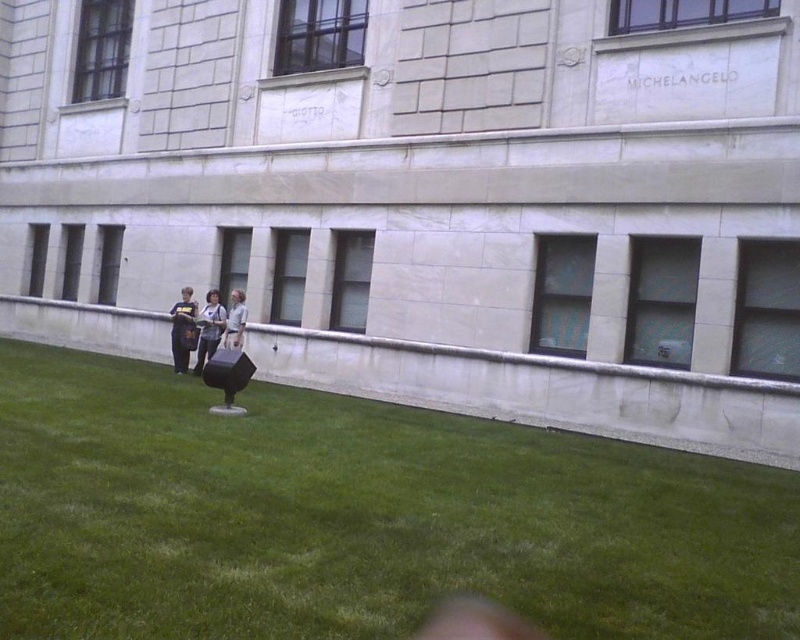
Question: Which of the following is the farthest from the observer?

Choices:
 (A) (194, 340)
 (B) (250, 630)

Answer: (A)

Question: Is green grass at lower center positioned before dark blue shirt at center?

Choices:
 (A) no
 (B) yes

Answer: (B)

Question: Is green grass at lower center to the right of light gray shirt at center from the viewer's perspective?

Choices:
 (A) no
 (B) yes

Answer: (B)

Question: Is dark blue shirt at center positioned behind light gray shirt at center?

Choices:
 (A) yes
 (B) no

Answer: (A)

Question: Which point is closer to the camera taking this photo?

Choices:
 (A) (236, 296)
 (B) (220, 326)
 (C) (176, 356)

Answer: (B)

Question: Which object is positioned closest to the green grass at lower center?

Choices:
 (A) dark gray fabric jacket at center
 (B) light gray shirt at center
 (C) dark blue shirt at center

Answer: (A)